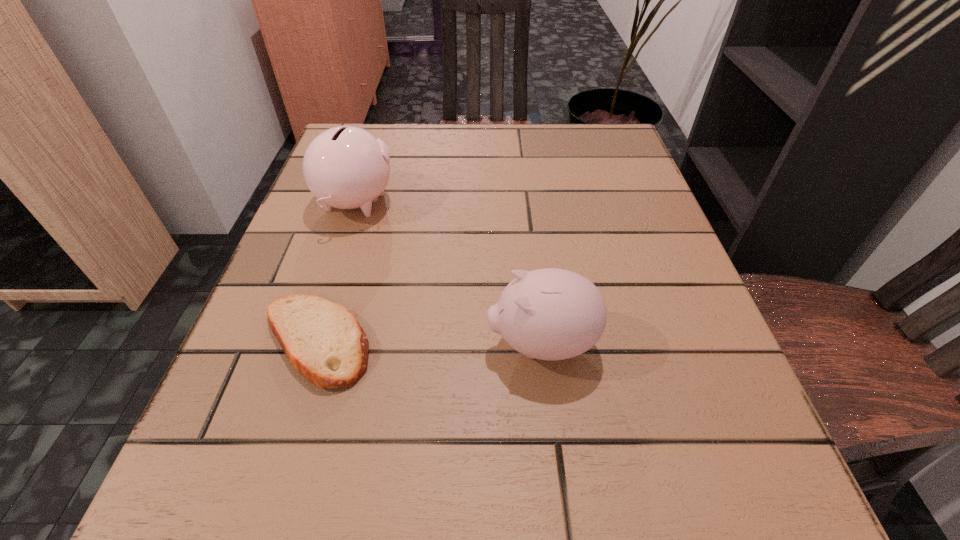
This screenshot has height=540, width=960. I want to click on free space between the shortest object and the right piggy bank, so click(428, 342).

At what (x,y) coordinates should I click in order to perform the action: click on unoccupied position between the nearer piggy bank and the left piggy bank. Please return your answer as a coordinate pair (x, y). The image size is (960, 540). Looking at the image, I should click on (448, 273).

Where is `empty space that is in between the shorter piggy bank and the farther piggy bank`? The height and width of the screenshot is (540, 960). empty space that is in between the shorter piggy bank and the farther piggy bank is located at coordinates (448, 273).

Identify the location of free space that is in between the farthest object and the right piggy bank. (448, 273).

This screenshot has width=960, height=540. I want to click on unoccupied area between the second tallest object and the shortest object, so click(428, 342).

The image size is (960, 540). Identify the location of free space between the pita bread and the right piggy bank. (428, 342).

At what (x,y) coordinates should I click in order to perform the action: click on unoccupied area between the taller piggy bank and the nearer piggy bank. Please return your answer as a coordinate pair (x, y). The image size is (960, 540). Looking at the image, I should click on (448, 273).

Locate an element on the screen. The height and width of the screenshot is (540, 960). free space between the taller piggy bank and the shortest object is located at coordinates (335, 272).

This screenshot has width=960, height=540. Find the location of `free point between the left piggy bank and the nearer piggy bank`. free point between the left piggy bank and the nearer piggy bank is located at coordinates (448, 273).

Locate an element on the screen. The height and width of the screenshot is (540, 960). vacant point located between the second shortest object and the farthest object is located at coordinates (448, 273).